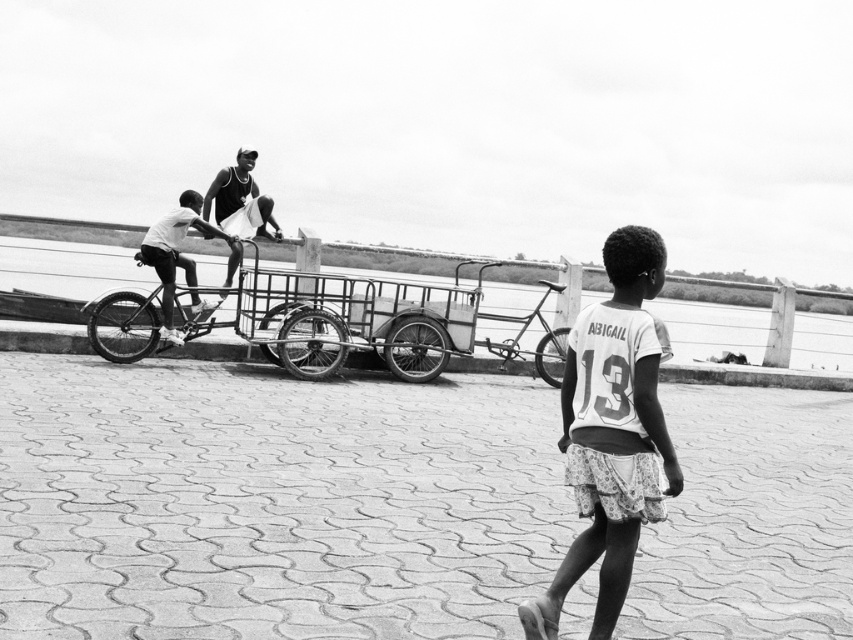
You are standing at the riverside promenade and notice the dark gray fabric shirt at center. Can you determine its exact location in the scene using the coordinate system provided?

The dark gray fabric shirt at center is located at point (181, 259) in the coordinate system provided.

You are standing at point (234, 184) and want to walk to the bicycle in the midground. Is the point (215, 305) between you and the bicycle?

Yes, point (215, 305) is between you and the bicycle because it is in front of point (234, 184) where you are standing.

You are a photographer standing at the riverside promenade. You want to take a photo of the metallic silver bicycle at center and the metallic wire cart at center. Based on their positions, which one is closer to the left side of the image?

The metallic wire cart at center is to the left of the metallic silver bicycle at center, so the metallic wire cart at center is closer to the left side of the image.